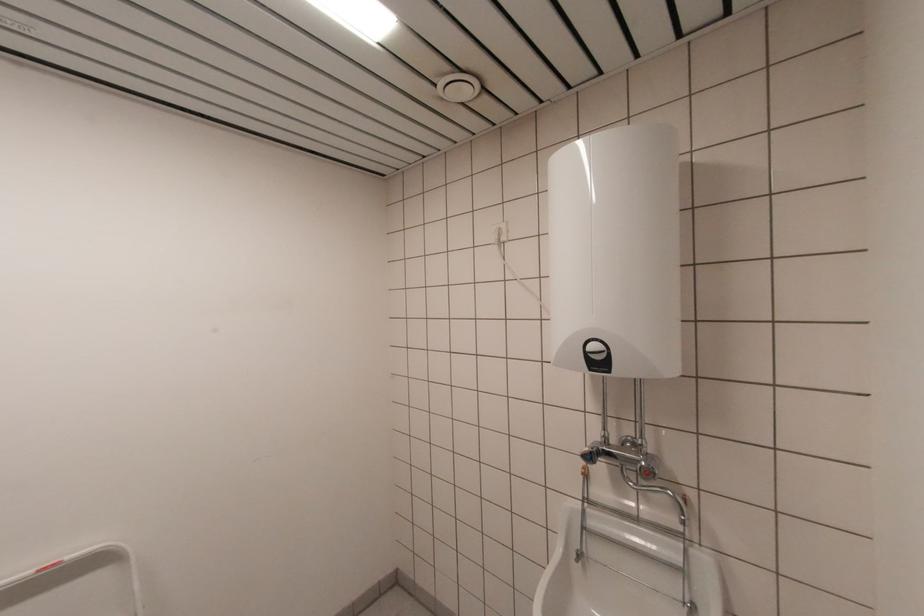
Describe the element at coordinates (594, 349) in the screenshot. I see `the water heater dial` at that location.